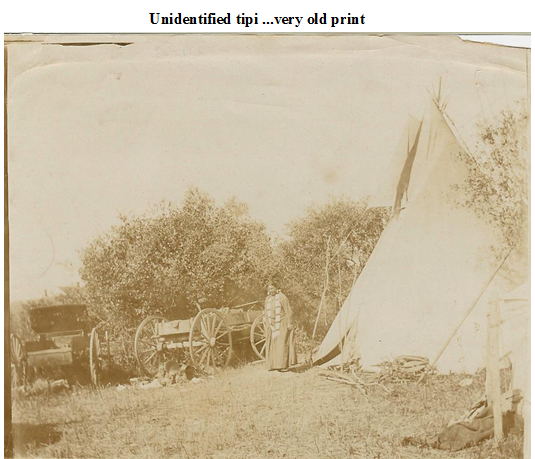
Find the location of a particular element. sepia toned photograph is located at coordinates (264, 206).